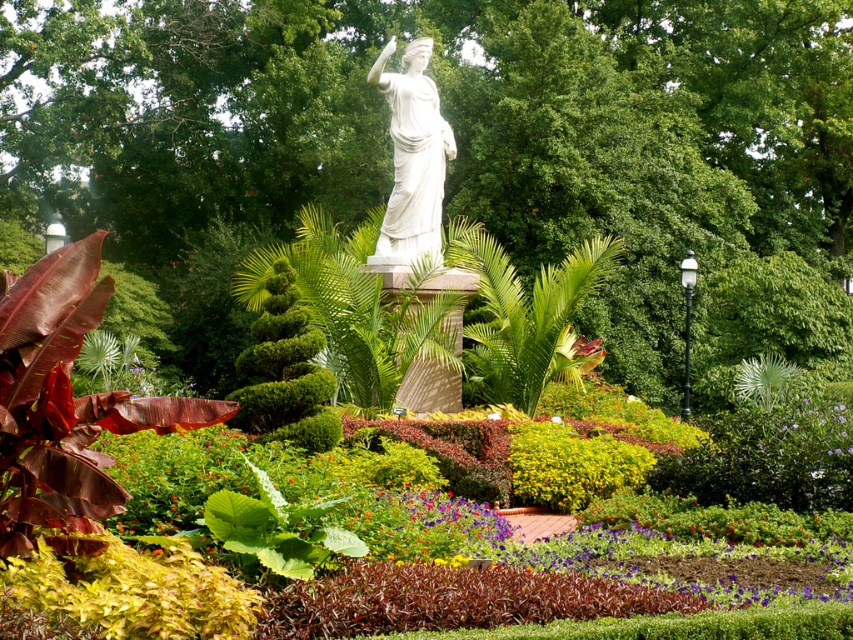
You are a landscape architect analyzing the garden layout. The central statue is positioned at coordinates 0.5, 0.5. Where is the green leafy tree at center located relative to the statue?

The green leafy tree at center is located at coordinates (456, 138), which is to the left and slightly above the central statue positioned at (426, 320).

You are a gardener who wants to water the green leafy tree at center and the green textured bush at center. Which one should you water first if you want to water the one closer to you first?

You should water the green leafy tree at center first because it is closer to you than the green textured bush at center, which is positioned behind it.

You are standing in the garden and want to take a photo of the green leafy tree at center. If your camera has a maximum focus range of 25 meters, will you be able to capture the tree clearly?

The green leafy tree at center and camera are 27.59 meters apart, which exceeds the camera maximum focus range of 25 meters. Therefore, you won not be able to capture the tree clearly.